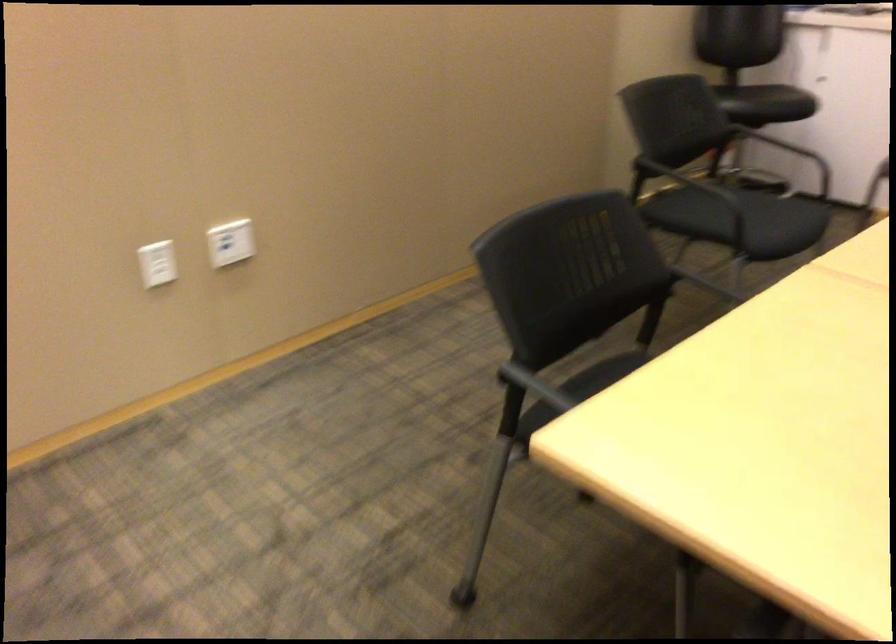
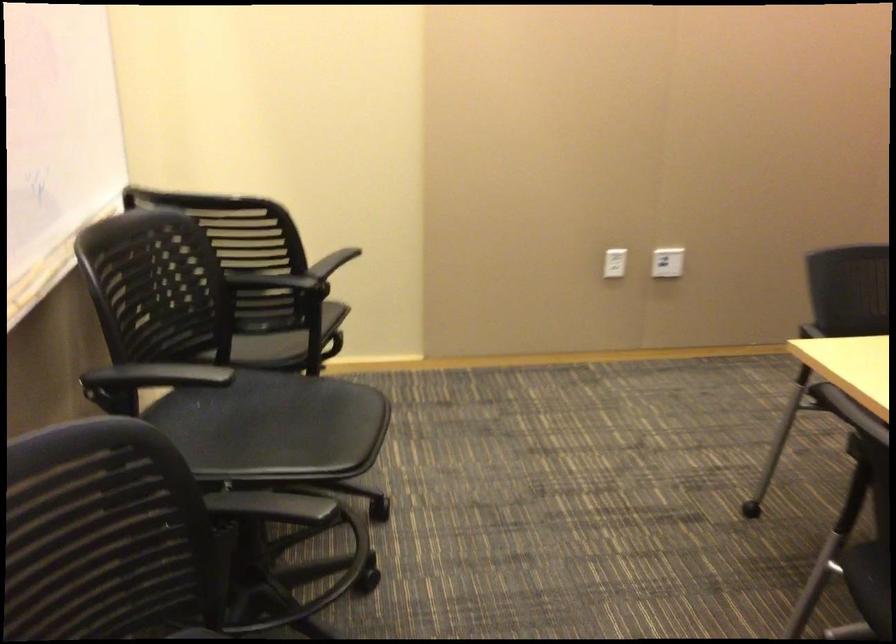
The point at (x=228, y=247) is marked in the first image. Where is the corresponding point in the second image?

(667, 261)